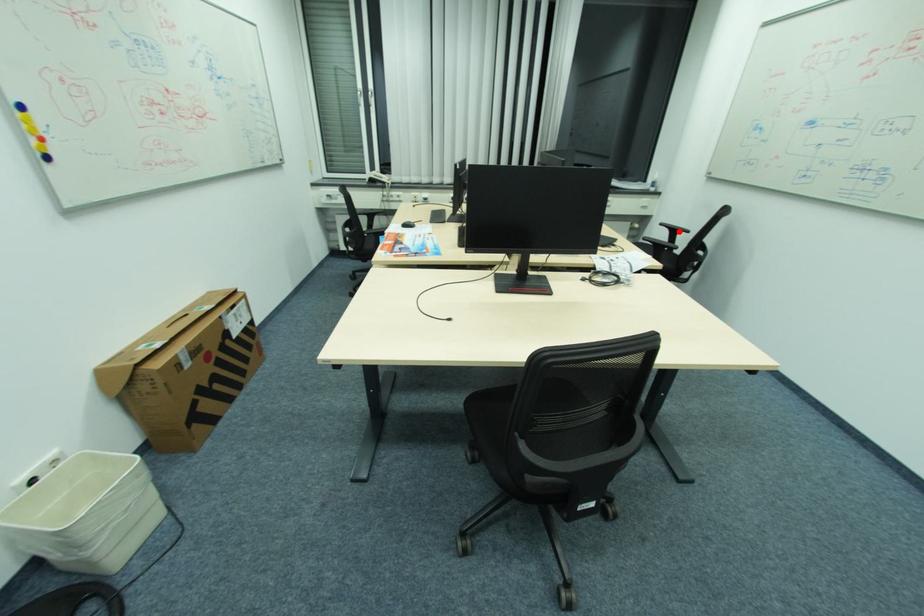
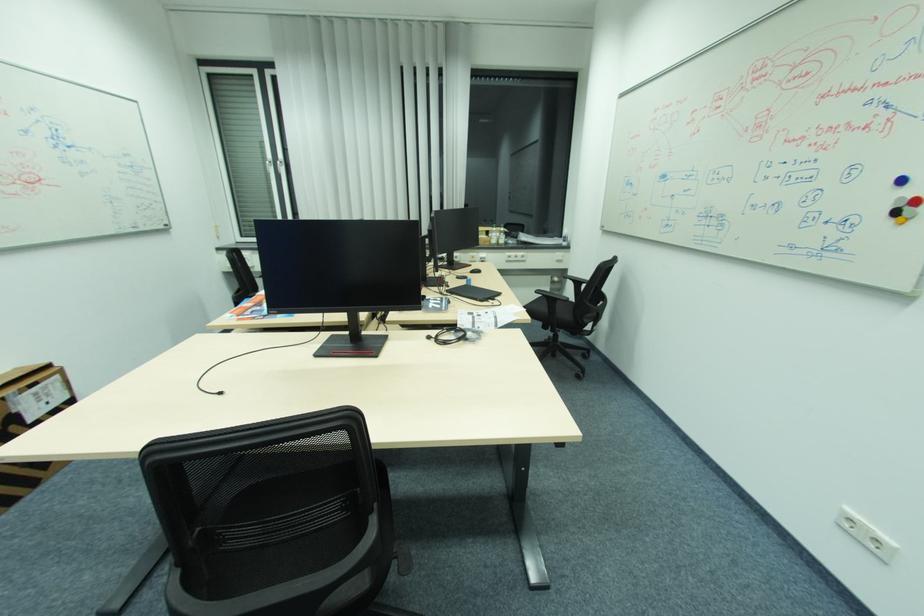
Question: I am providing you with two images of the same scene from different viewpoints. Given a red point in image1, look at the same physical point in image2. Is it:

Choices:
 (A) Closer to the viewpoint
 (B) Farther from the viewpoint

Answer: (A)